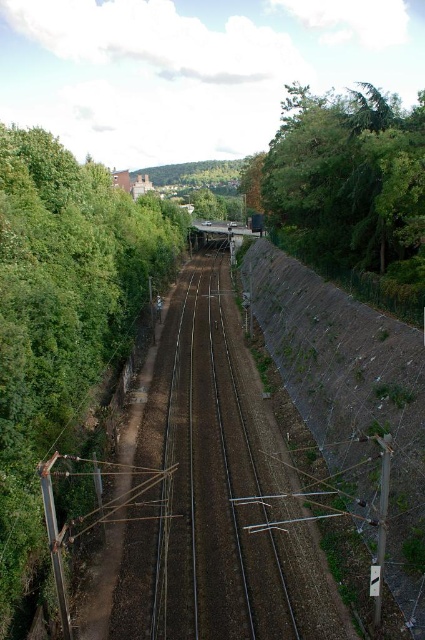
You are a train engineer observing the tracks ahead. You notice the brown dirt train track at center and the brown textured hillside at right. Which object is positioned lower in the image?

The brown dirt train track at center is positioned lower than the brown textured hillside at right.

You are a train engineer observing the railway from the elevated bridge. You see a green leafy tree at left and a brown dirt train track at center. Which object is positioned higher in the scene?

The green leafy tree at left is above the brown dirt train track at center, so the green leafy tree at left is higher in the scene.

From the picture: You are standing on the railway bridge looking down at the tracks. There is a specific point marked at coordinates point (20, 180). If you want to reach that point safely, what is the minimum distance you need to walk from your current position?

The minimum distance you need to walk from your current position to reach point (20, 180) is 32.09 meters.